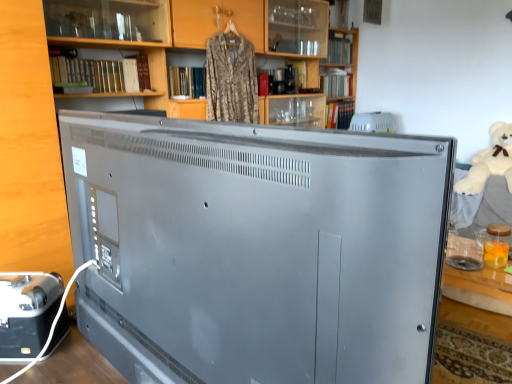
Question: Is white plastic speaker at upper center, the 1th appliance in the right-to-left sequence, taller than satin gray television at center?

Choices:
 (A) yes
 (B) no

Answer: (B)

Question: Considering the relative sizes of white plastic speaker at upper center, the 1th appliance in the right-to-left sequence, and satin gray television at center in the image provided, is white plastic speaker at upper center, the 1th appliance in the right-to-left sequence, bigger than satin gray television at center?

Choices:
 (A) yes
 (B) no

Answer: (B)

Question: Is satin gray television at center completely or partially inside white plastic speaker at upper center, the 1th appliance in the right-to-left sequence?

Choices:
 (A) yes
 (B) no

Answer: (B)

Question: Is white plastic speaker at upper center, placed as the 2th appliance when sorted from left to right, positioned behind satin gray television at center?

Choices:
 (A) yes
 (B) no

Answer: (A)

Question: From the image's perspective, is white plastic speaker at upper center, the 1th appliance viewed from the top, below satin gray television at center?

Choices:
 (A) no
 (B) yes

Answer: (A)

Question: Does white plastic speaker at upper center, the 1th appliance in the right-to-left sequence, turn towards satin gray television at center?

Choices:
 (A) yes
 (B) no

Answer: (B)

Question: From the image's perspective, is metallic silver toaster at lower left, placed as the second appliance when sorted from right to left, under satin gray television at center?

Choices:
 (A) yes
 (B) no

Answer: (A)

Question: Is metallic silver toaster at lower left, acting as the 1th appliance starting from the left, not within satin gray television at center?

Choices:
 (A) yes
 (B) no

Answer: (A)

Question: Is metallic silver toaster at lower left, the 1th appliance in the bottom-to-top sequence, smaller than satin gray television at center?

Choices:
 (A) no
 (B) yes

Answer: (B)

Question: From the image's perspective, is metallic silver toaster at lower left, the 1th appliance in the bottom-to-top sequence, located above satin gray television at center?

Choices:
 (A) no
 (B) yes

Answer: (A)

Question: Is metallic silver toaster at lower left, which is the 2th appliance in back-to-front order, beside satin gray television at center?

Choices:
 (A) yes
 (B) no

Answer: (B)

Question: From a real-world perspective, does metallic silver toaster at lower left, acting as the 1th appliance starting from the left, sit lower than satin gray television at center?

Choices:
 (A) no
 (B) yes

Answer: (B)

Question: From the image's perspective, is white plush bear at right on matte wood bookcase at upper center?

Choices:
 (A) yes
 (B) no

Answer: (B)